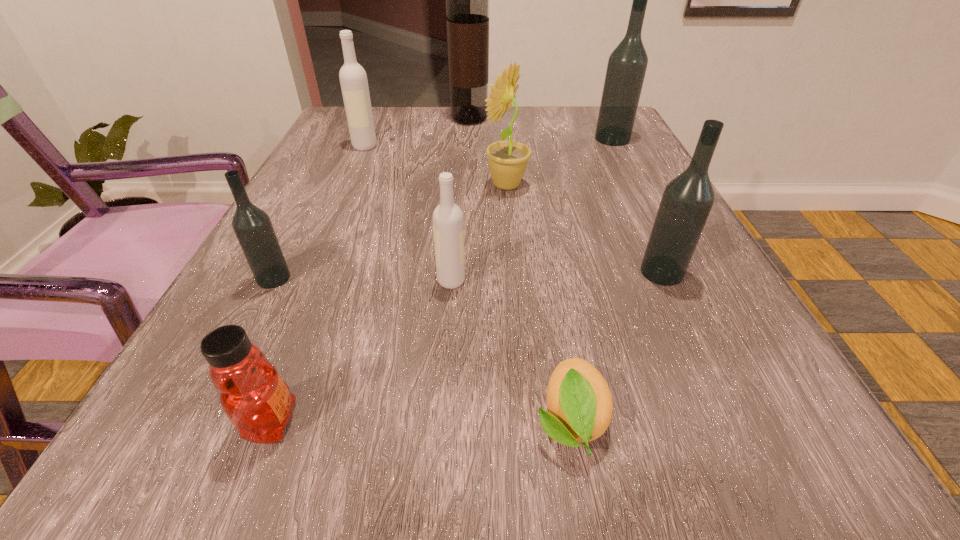
Identify the location of the right white vodka. This screenshot has width=960, height=540. (448, 226).

At what (x,y) coordinates should I click in order to perform the action: click on the leftmost black vodka. Please return your answer as a coordinate pair (x, y). This screenshot has width=960, height=540. Looking at the image, I should click on (252, 226).

Locate an element on the screen. the leftmost vodka is located at coordinates (252, 226).

Where is `honey`? This screenshot has width=960, height=540. honey is located at coordinates (254, 397).

At what (x,y) coordinates should I click in order to perform the action: click on the shortest object. Please return your answer as a coordinate pair (x, y). Looking at the image, I should click on (579, 401).

This screenshot has height=540, width=960. In order to click on yellow lemon in this screenshot , I will do `click(579, 401)`.

Locate an element on the screen. This screenshot has height=540, width=960. vacant space situated on the front of the farthest object is located at coordinates (467, 185).

You are a GUI agent. You are given a task and a screenshot of the screen. Output one action in this format:
    pyautogui.click(x=<x>, y=<y>)
    Task: Click on the vacant space positioned 0.100m on the front of the biggest black vodka
    Image resolution: width=960 pixels, height=540 pixels.
    Given the screenshot: What is the action you would take?
    pyautogui.click(x=627, y=167)

This screenshot has height=540, width=960. In order to click on vacant space located 0.200m on the right of the bigger white vodka in this screenshot , I will do `click(465, 146)`.

This screenshot has height=540, width=960. Find the location of `free spot located 0.120m on the back of the second smallest black vodka`. free spot located 0.120m on the back of the second smallest black vodka is located at coordinates (636, 217).